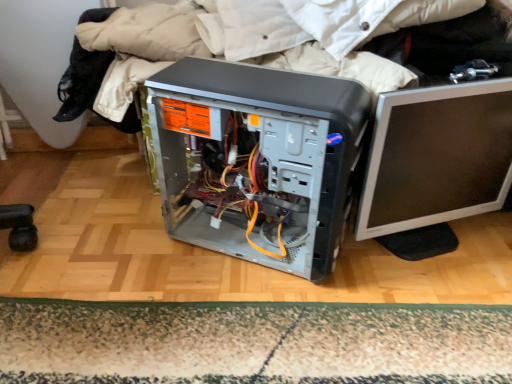
Question: Is carpeted mat at lower center positioned in front of satin black computer tower at center?

Choices:
 (A) yes
 (B) no

Answer: (B)

Question: From a real-world perspective, is carpeted mat at lower center on satin black computer tower at center?

Choices:
 (A) no
 (B) yes

Answer: (A)

Question: Is carpeted mat at lower center facing away from satin black computer tower at center?

Choices:
 (A) yes
 (B) no

Answer: (A)

Question: Does carpeted mat at lower center have a lesser height compared to satin black computer tower at center?

Choices:
 (A) yes
 (B) no

Answer: (A)

Question: Is carpeted mat at lower center to the right of satin black computer tower at center from the viewer's perspective?

Choices:
 (A) yes
 (B) no

Answer: (B)

Question: Is carpeted mat at lower center outside satin black computer tower at center?

Choices:
 (A) no
 (B) yes

Answer: (B)

Question: From the image's perspective, is satin black computer tower at center above silver/black plastic monitor at right?

Choices:
 (A) no
 (B) yes

Answer: (A)

Question: Considering the relative positions of satin black computer tower at center and silver/black plastic monitor at right in the image provided, is satin black computer tower at center behind silver/black plastic monitor at right?

Choices:
 (A) no
 (B) yes

Answer: (A)

Question: From the image's perspective, would you say satin black computer tower at center is shown under silver/black plastic monitor at right?

Choices:
 (A) yes
 (B) no

Answer: (A)

Question: Is satin black computer tower at center positioned in front of silver/black plastic monitor at right?

Choices:
 (A) no
 (B) yes

Answer: (B)

Question: Are satin black computer tower at center and silver/black plastic monitor at right beside each other?

Choices:
 (A) yes
 (B) no

Answer: (B)

Question: Is satin black computer tower at center taller than silver/black plastic monitor at right?

Choices:
 (A) no
 (B) yes

Answer: (B)

Question: Can you confirm if silver/black plastic monitor at right is positioned to the left of carpeted mat at lower center?

Choices:
 (A) yes
 (B) no

Answer: (B)